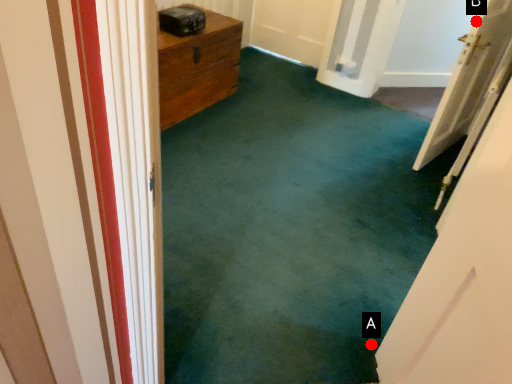
Question: Two points are circled on the image, labeled by A and B beside each circle. Which of the following is the farthest from the observer?

Choices:
 (A) A is further
 (B) B is further

Answer: (B)